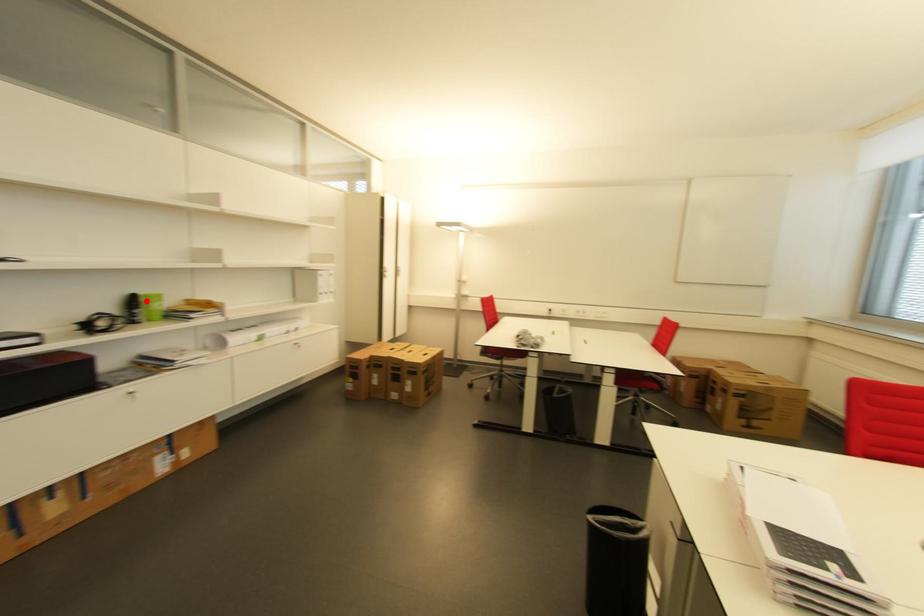
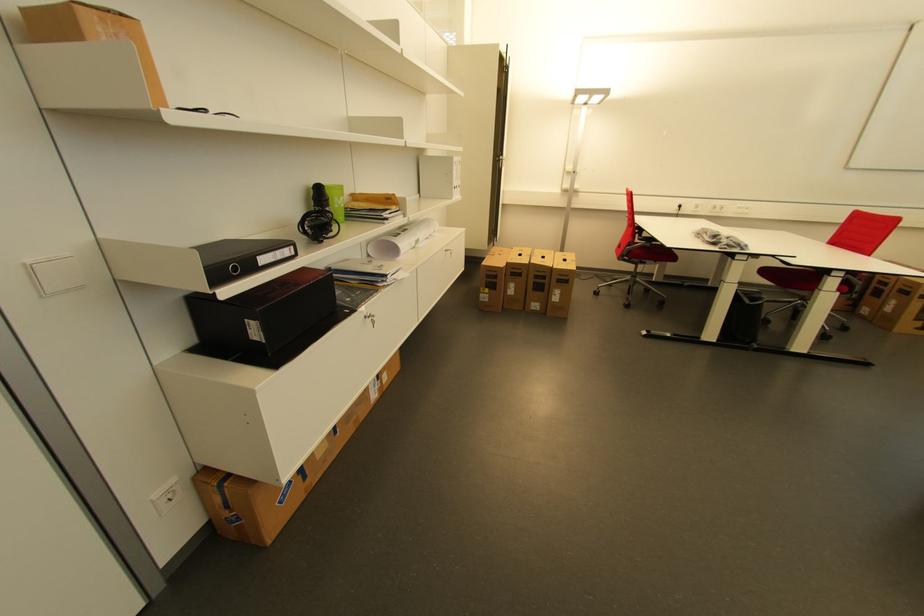
Question: I am providing you with two images of the same scene from different viewpoints. A red point is marked on the first image. Can you still see the location of the red point in image 2?

Choices:
 (A) Yes
 (B) No

Answer: (A)